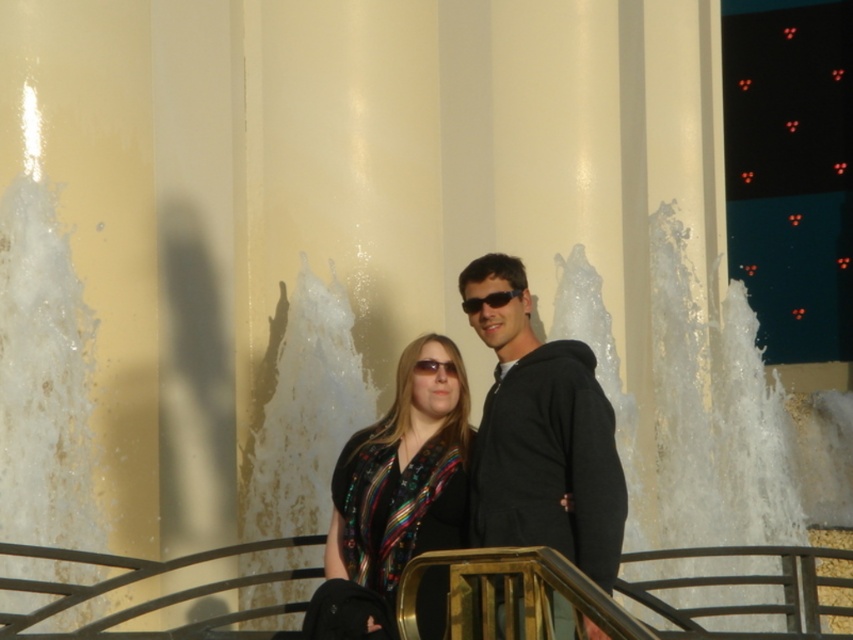
Where is the black matte hoodie at center located in the image?

The black matte hoodie at center is located at point coordinates of (541, 436).

Looking at this image, you are a photographer trying to capture a closeup shot of the black matte hoodie at center and the black plastic sunglasses at center. Given that your camera has a minimum focus distance of 5 feet, will you be able to focus on both objects simultaneously?

The distance between the black matte hoodie at center and the black plastic sunglasses at center is 8.76 feet. Since the minimum focus distance of your camera is 5 feet, you can focus on both objects as they are more than 5 feet away from the camera.